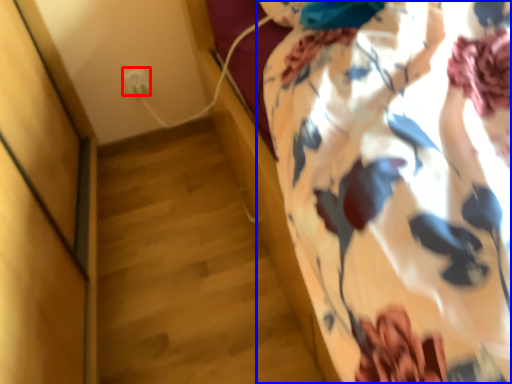
Question: Among these objects, which one is farthest to the camera, electric outlet (highlighted by a red box) or curtain (highlighted by a blue box)?

Choices:
 (A) electric outlet
 (B) curtain

Answer: (A)